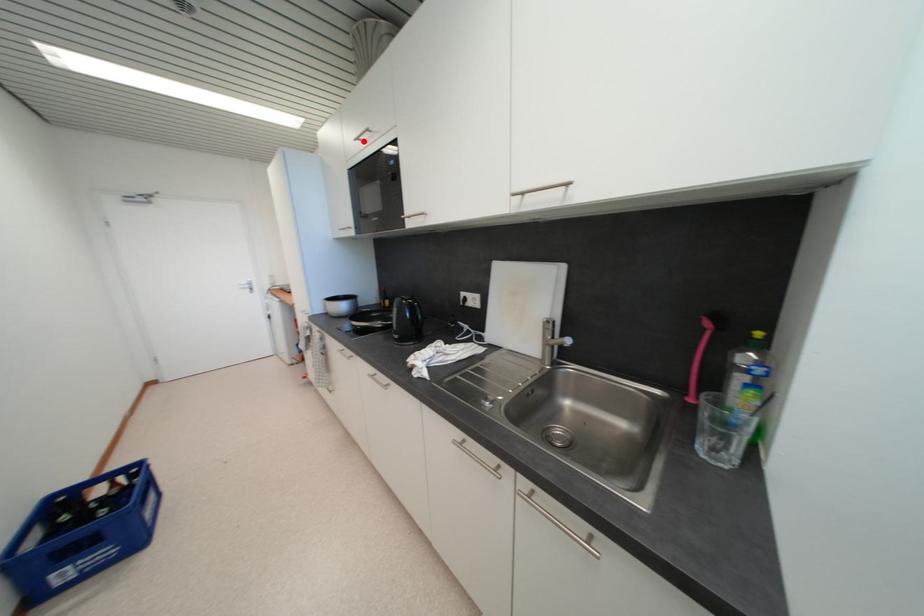
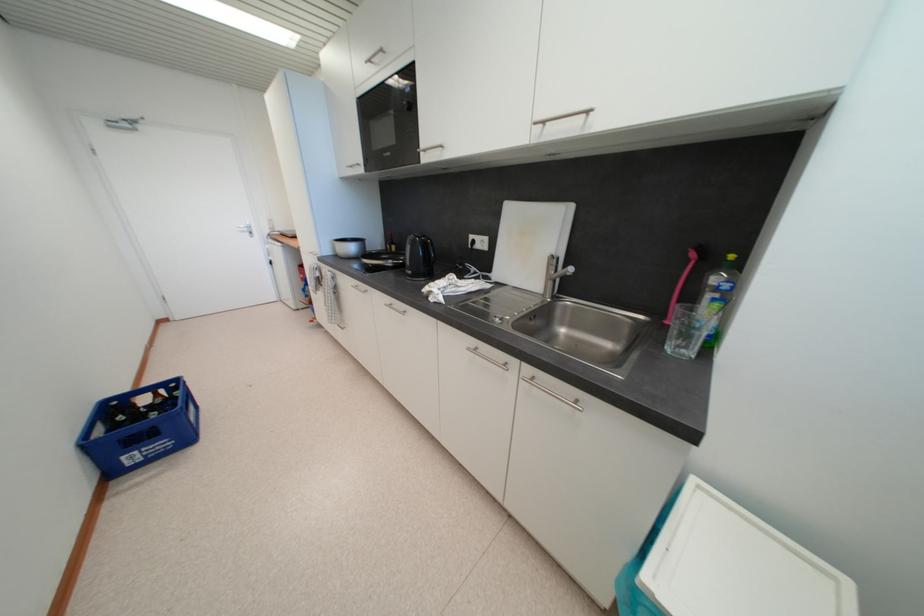
Question: I am providing you with two images of the same scene from different viewpoints. A red point is shown in image1. For the corresponding object point in image2, is it positioned nearer or farther from the camera?

Choices:
 (A) Nearer
 (B) Farther

Answer: (B)